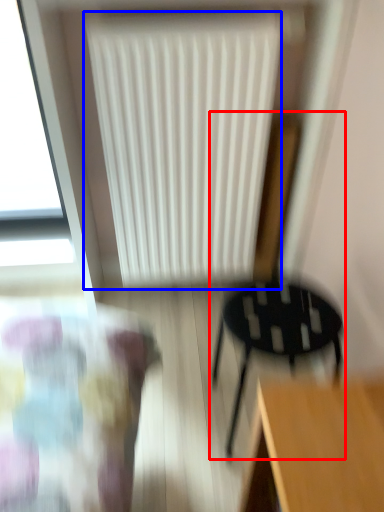
Question: Which object appears farthest to the camera in this image, chair (highlighted by a red box) or radiator (highlighted by a blue box)?

Choices:
 (A) chair
 (B) radiator

Answer: (B)